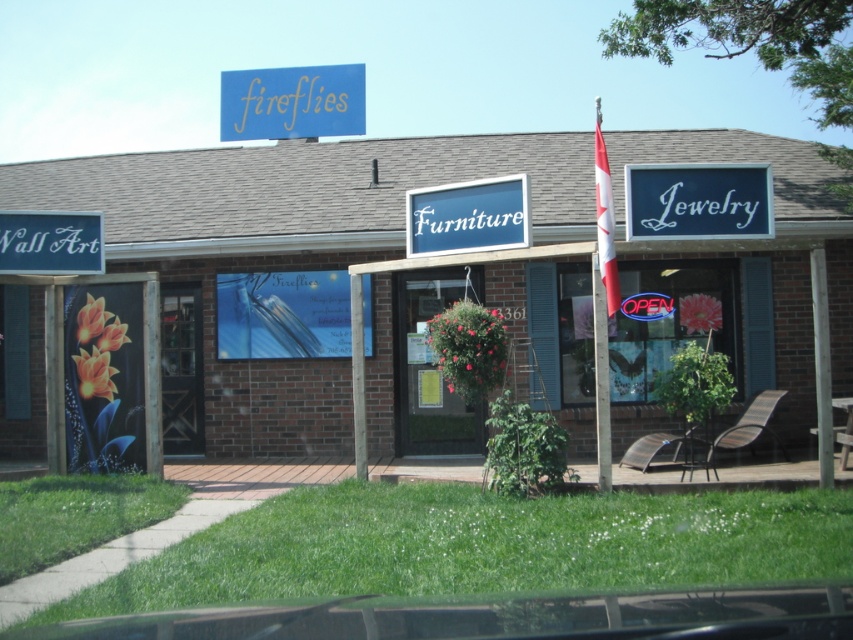
Question: Which point is farther to the camera?

Choices:
 (A) (434, 214)
 (B) (86, 250)

Answer: (B)

Question: Can you confirm if blue matte sign at upper center is positioned below white matte wall art at left?

Choices:
 (A) yes
 (B) no

Answer: (B)

Question: Does blue matte sign at upper center appear on the left side of white matte wall art at left?

Choices:
 (A) no
 (B) yes

Answer: (A)

Question: Does blue/white sign at upper right have a lesser width compared to white plastic signboard at center?

Choices:
 (A) yes
 (B) no

Answer: (B)

Question: Which point appears closest to the camera in this image?

Choices:
 (A) (93, 262)
 (B) (428, 243)
 (C) (312, 449)

Answer: (B)

Question: Based on their relative distances, which object is farther from the white matte wall art at left?

Choices:
 (A) blue matte sign at upper center
 (B) brick wall at center

Answer: (A)